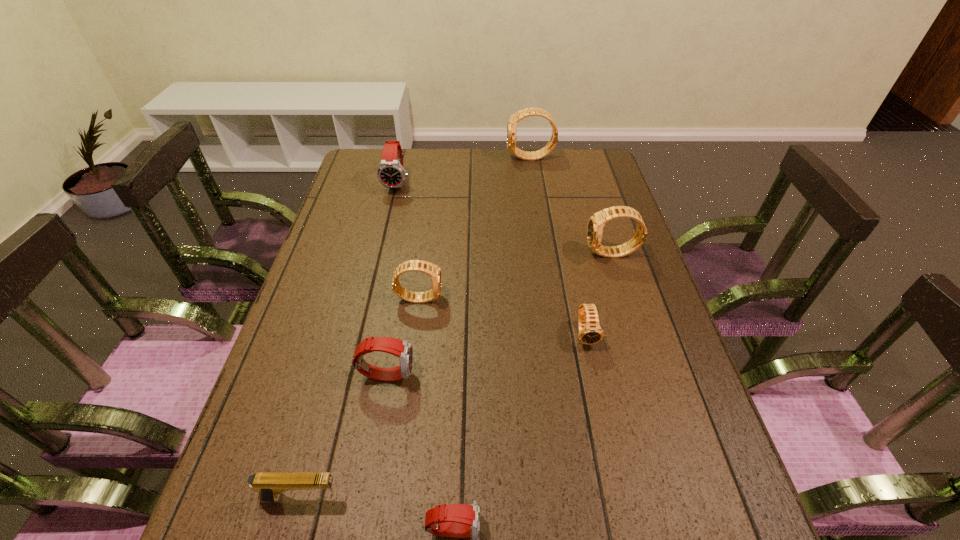
Identify the location of unoccupied area between the sixth nearest watch and the nearest black watch. This screenshot has height=540, width=960. (492, 259).

Locate an element on the screen. Image resolution: width=960 pixels, height=540 pixels. vacant space in between the farthest red watch and the fourth nearest object is located at coordinates (492, 259).

Image resolution: width=960 pixels, height=540 pixels. What are the coordinates of `empty space that is in between the pistol and the tallest object` in the screenshot? It's located at (416, 328).

At what (x,y) coordinates should I click in order to perform the action: click on object that ranks as the seventh closest to the tan pistol. Please return your answer as a coordinate pair (x, y). Looking at the image, I should click on (527, 112).

Locate which object is the second closest to the tan pistol. Please provide its 2D coordinates. Your answer should be formatted as a tuple, i.e. [(x, y)], where the tuple contains the x and y coordinates of a point satisfying the conditions above.

[(402, 349)]

Find the location of a particular element. The image size is (960, 540). watch that stands as the closest to the fourth farthest object is located at coordinates (402, 349).

I want to click on the fifth closest watch to the fourth nearest watch, so click(x=462, y=521).

Where is `black watch that is the third nearest to the leftmost black watch`? The image size is (960, 540). black watch that is the third nearest to the leftmost black watch is located at coordinates (527, 112).

I want to click on black watch that is the fourth nearest to the second nearest object, so click(527, 112).

Find the location of a particular element. red watch that stands as the second closest to the second nearest watch is located at coordinates (391, 174).